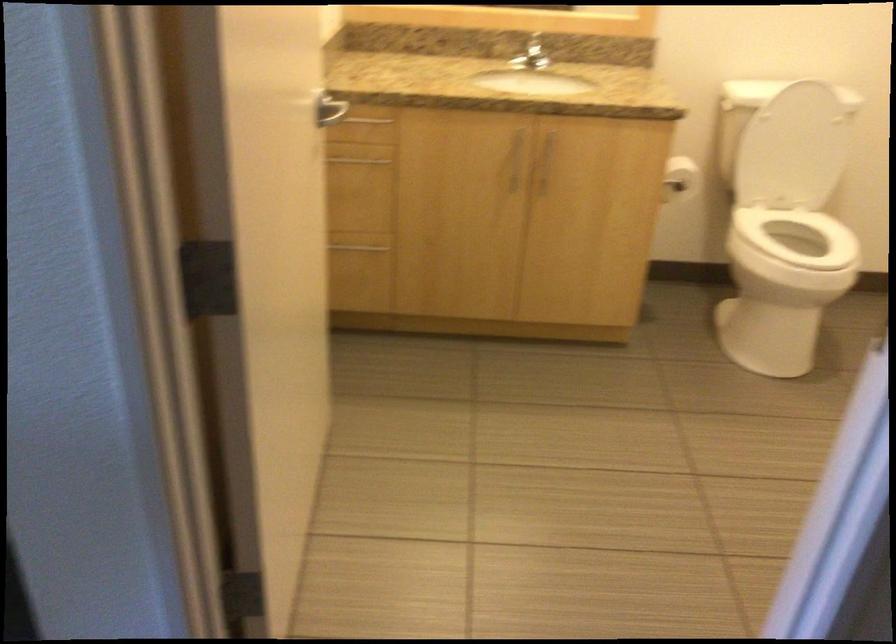
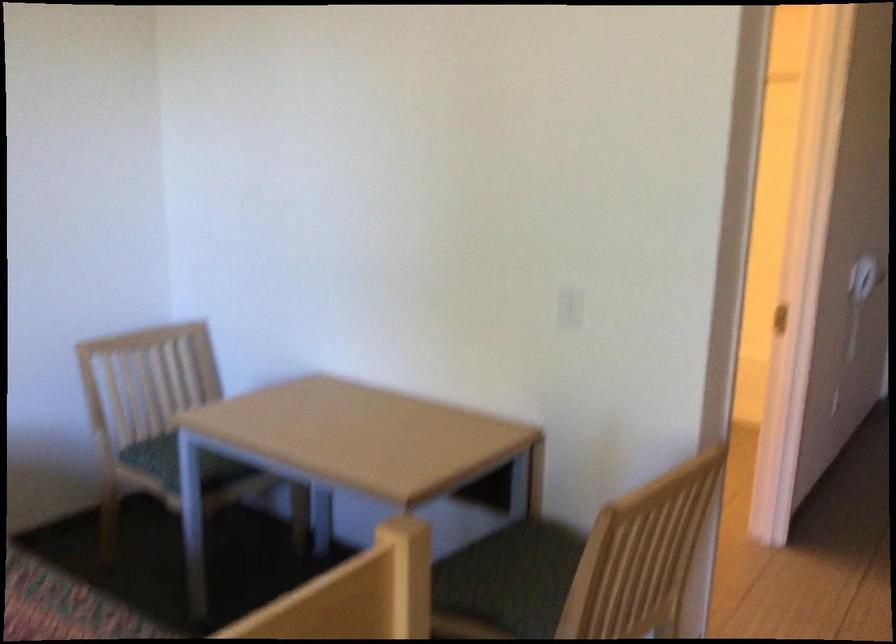
Question: I am providing you with two images of the same scene from different viewpoints. Please identify which objects are invisible in image2.

Choices:
 (A) toilet lid
 (B) chair sitting surface
 (C) white electrical outlet
 (D) toothbrush holder

Answer: (A)